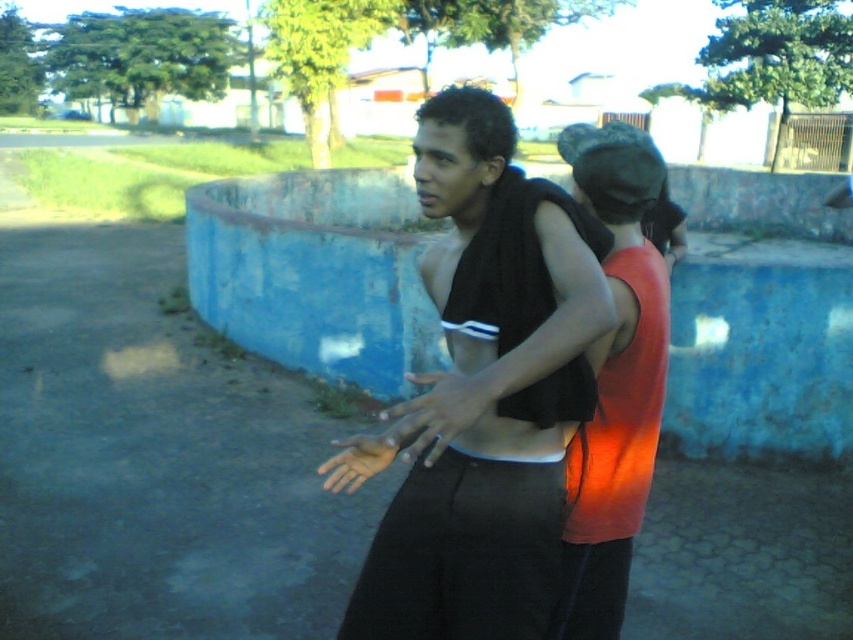
Does matte black tank top at center appear on the left side of orange matte tank top at center?

Indeed, matte black tank top at center is positioned on the left side of orange matte tank top at center.

Who is taller, matte black tank top at center or orange matte tank top at center?

With more height is matte black tank top at center.

Does point (514, 216) come farther from viewer compared to point (552, 630)?

No, it is not.

Locate an element on the screen. The height and width of the screenshot is (640, 853). matte black tank top at center is located at coordinates (486, 390).

Does matte black tank top at center have a greater height compared to matte black hand at center?

Yes.

This screenshot has width=853, height=640. What do you see at coordinates (486, 390) in the screenshot?
I see `matte black tank top at center` at bounding box center [486, 390].

At what (x,y) coordinates should I click in order to perform the action: click on matte black tank top at center. Please return your answer as a coordinate pair (x, y). This screenshot has width=853, height=640. Looking at the image, I should click on (486, 390).

What do you see at coordinates (444, 413) in the screenshot? I see `matte black hand at center` at bounding box center [444, 413].

Is matte black hand at center thinner than smooth skin hand at center?

No.

The image size is (853, 640). Describe the element at coordinates (444, 413) in the screenshot. I see `matte black hand at center` at that location.

I want to click on matte black hand at center, so click(444, 413).